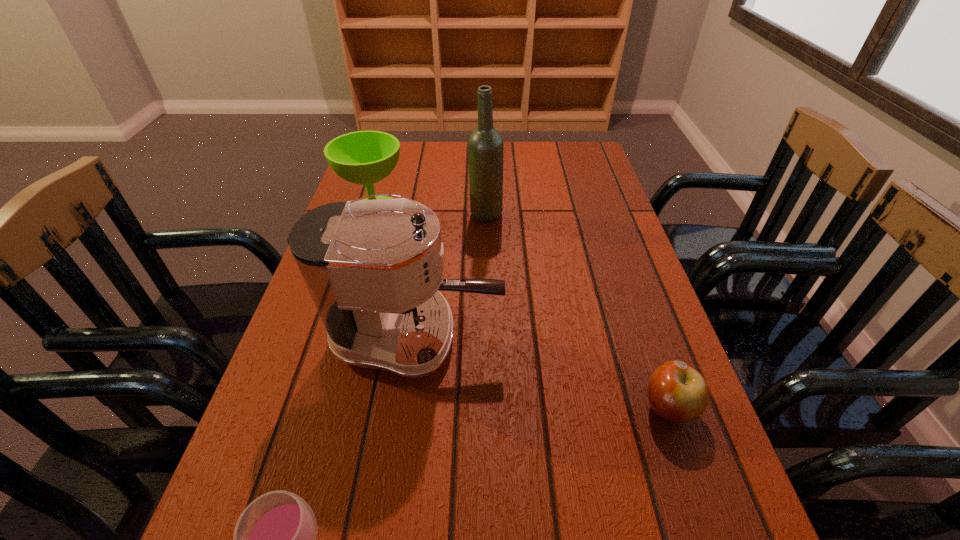
Locate an element on the screen. Image resolution: width=960 pixels, height=540 pixels. object that is the second closest to the farther wineglass is located at coordinates (373, 268).

Locate an element on the screen. This screenshot has height=540, width=960. free point that satisfies the following two spatial constraints: 1. on the front-facing side of the apple; 2. on the right side of the coffee maker is located at coordinates pyautogui.click(x=406, y=407).

Identify the location of vacant space that satisfies the following two spatial constraints: 1. on the back side of the shortest object; 2. on the front-facing side of the coffee maker. (644, 338).

Find the location of a particular element. The width and height of the screenshot is (960, 540). vacant region that satisfies the following two spatial constraints: 1. on the front-facing side of the shortest object; 2. on the left side of the coffee maker is located at coordinates 406,407.

Find the location of a particular element. This screenshot has height=540, width=960. free space that satisfies the following two spatial constraints: 1. on the front-facing side of the rightmost object; 2. on the left side of the coffee maker is located at coordinates (406, 407).